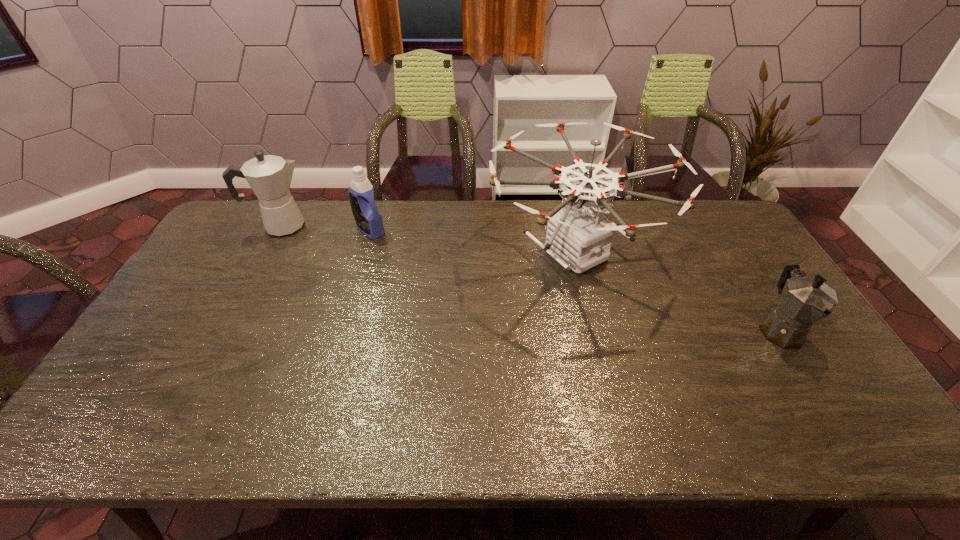
At what (x,y) coordinates should I click in order to perform the action: click on the tallest object. Please return your answer as a coordinate pair (x, y). Image resolution: width=960 pixels, height=540 pixels. Looking at the image, I should click on (578, 234).

Identify the location of drone. Image resolution: width=960 pixels, height=540 pixels. (578, 234).

At what (x,y) coordinates should I click in order to perform the action: click on the leftmost object. Please return your answer as a coordinate pair (x, y). This screenshot has height=540, width=960. Looking at the image, I should click on (269, 176).

Locate an element on the screen. This screenshot has width=960, height=540. the third shortest object is located at coordinates (269, 176).

This screenshot has width=960, height=540. In order to click on the third object from right to left in this screenshot , I will do `click(368, 219)`.

I want to click on the nearer coffeepot, so click(804, 300).

Where is `the right coffeepot`? The image size is (960, 540). the right coffeepot is located at coordinates (804, 300).

The image size is (960, 540). What are the coordinates of `free space located on the front of the drone` in the screenshot? It's located at (611, 401).

Where is `vacant area situated on the right of the third shortest object`? vacant area situated on the right of the third shortest object is located at coordinates (386, 226).

The width and height of the screenshot is (960, 540). I want to click on vacant space located on the right of the detergent, so click(498, 230).